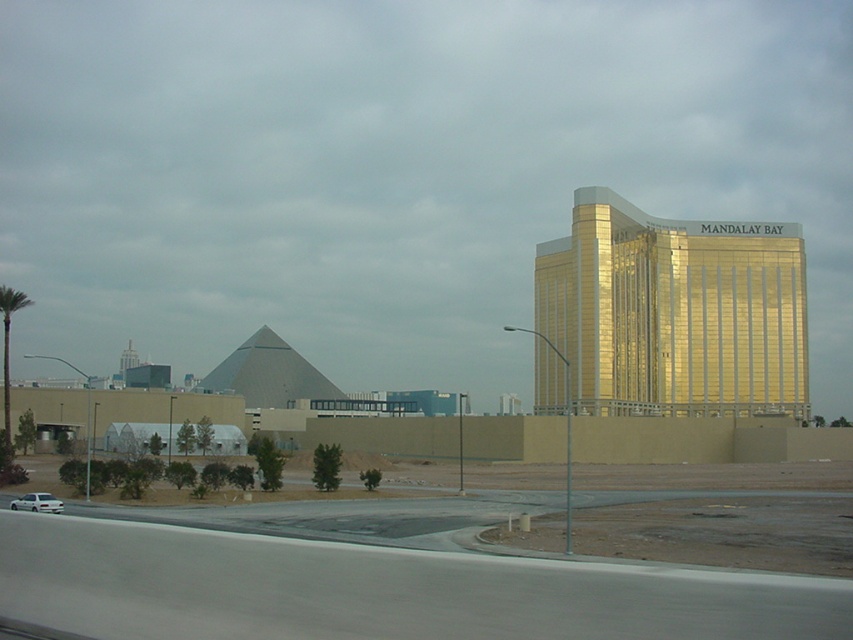
Can you confirm if gray metallic pyramid at center-left is positioned to the right of white matte car at lower left?

Incorrect, gray metallic pyramid at center-left is not on the right side of white matte car at lower left.

Between gray metallic pyramid at center-left and white matte car at lower left, which one appears on the right side from the viewer's perspective?

white matte car at lower left

Between point (312, 376) and point (48, 509), which one is positioned behind?

Point (312, 376)

You are a GUI agent. You are given a task and a screenshot of the screen. Output one action in this format:
    pyautogui.click(x=<x>, y=<y>)
    Task: Click on the gray metallic pyramid at center-left
    
    Given the screenshot: What is the action you would take?
    pyautogui.click(x=268, y=374)

Is gold reflective building at right further to camera compared to white matte car at lower left?

That is True.

Consider the image. Which is above, gold reflective building at right or white matte car at lower left?

Positioned higher is gold reflective building at right.

Between point (631, 330) and point (26, 497), which one is positioned behind?

Positioned behind is point (631, 330).

Find the location of `gold reflective building at right`. gold reflective building at right is located at coordinates (674, 310).

I want to click on gray asphalt highway at lower left, so click(x=376, y=589).

Can you confirm if gray asphalt highway at lower left is shorter than white matte car at lower left?

No, gray asphalt highway at lower left is not shorter than white matte car at lower left.

Which is in front, point (579, 632) or point (57, 506)?

Positioned in front is point (579, 632).

Identify the location of gray asphalt highway at lower left. This screenshot has width=853, height=640. (376, 589).